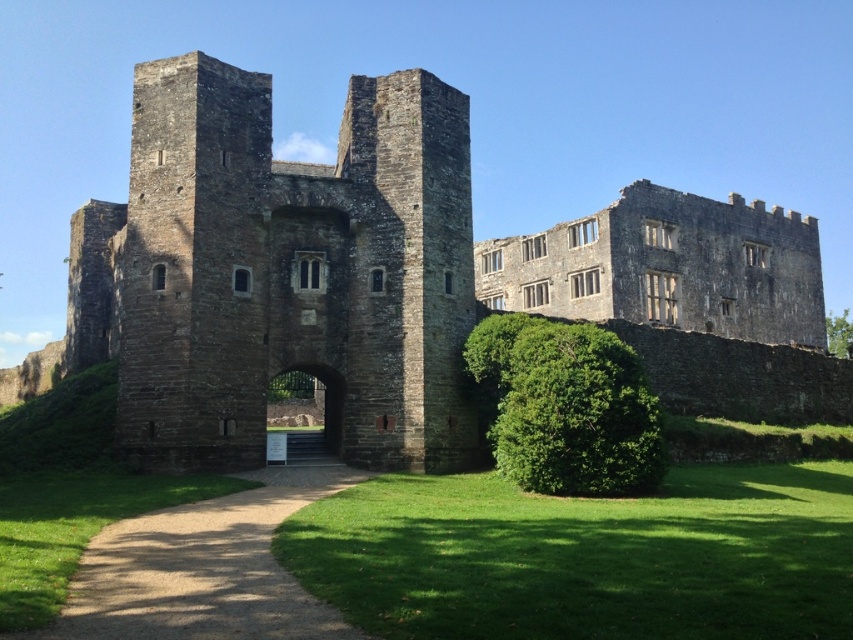
Can you confirm if brown stone castle at center is positioned below green leafy hedge at center?

Actually, brown stone castle at center is above green leafy hedge at center.

Which is in front, point (257, 337) or point (532, 454)?

Point (532, 454) is in front.

What do you see at coordinates (277, 275) in the screenshot? I see `brown stone castle at center` at bounding box center [277, 275].

The height and width of the screenshot is (640, 853). I want to click on brown stone castle at center, so click(277, 275).

Is brown stone castle at center thinner than brown gravel path at center?

Incorrect, brown stone castle at center's width is not less than brown gravel path at center's.

Measure the distance between point (670, 276) and camera.

Point (670, 276) and camera are 311.87 feet apart from each other.

Locate an element on the screen. brown stone castle at center is located at coordinates (277, 275).

Does brown gravel path at center appear over green leafy hedge at center?

Incorrect, brown gravel path at center is not positioned above green leafy hedge at center.

Is brown gravel path at center to the left of green leafy hedge at center from the viewer's perspective?

Correct, you'll find brown gravel path at center to the left of green leafy hedge at center.

Is point (241, 563) in front of point (598, 410)?

That is True.

Find the location of `brown gravel path at center`. brown gravel path at center is located at coordinates (202, 570).